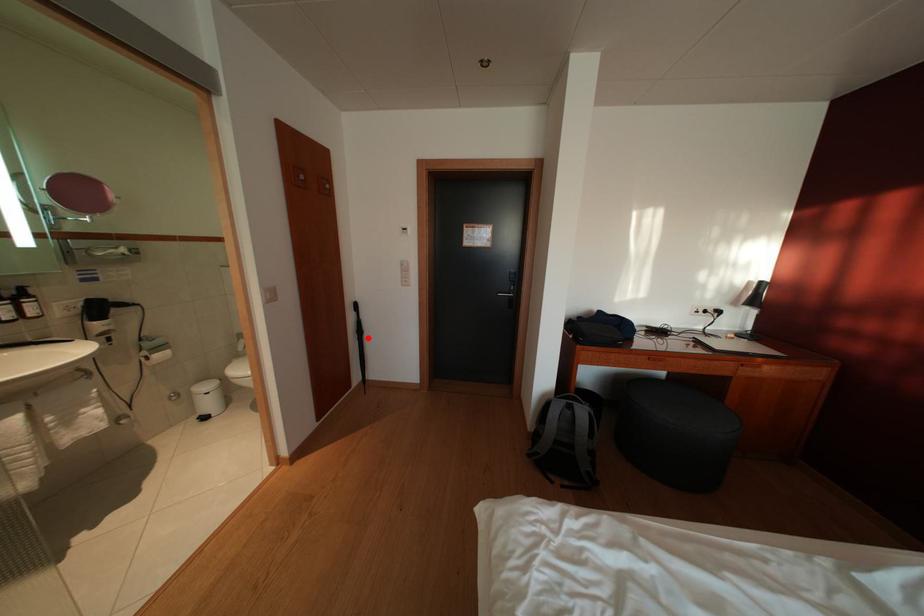
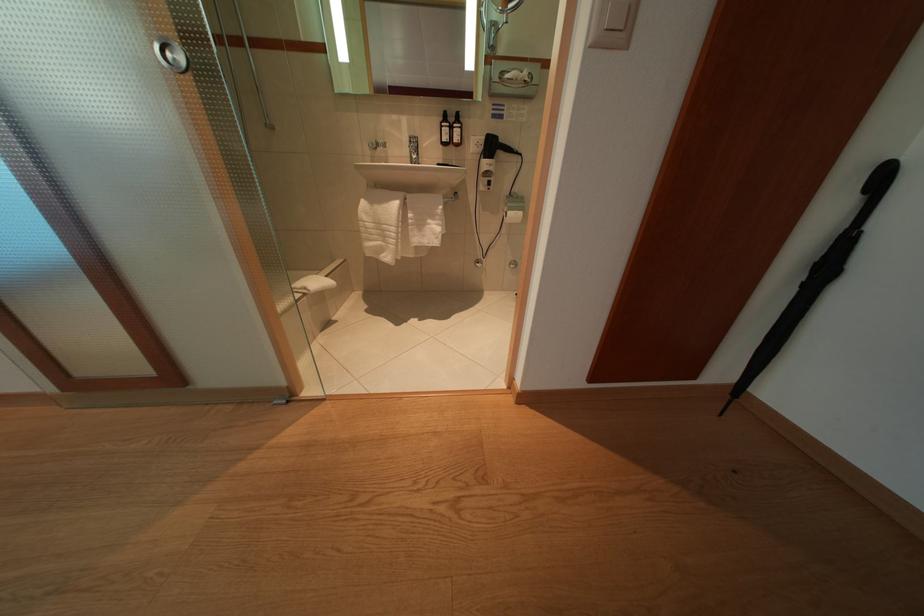
Locate, in the second image, the point that corresponds to the highlighted location in the first image.

(834, 275)